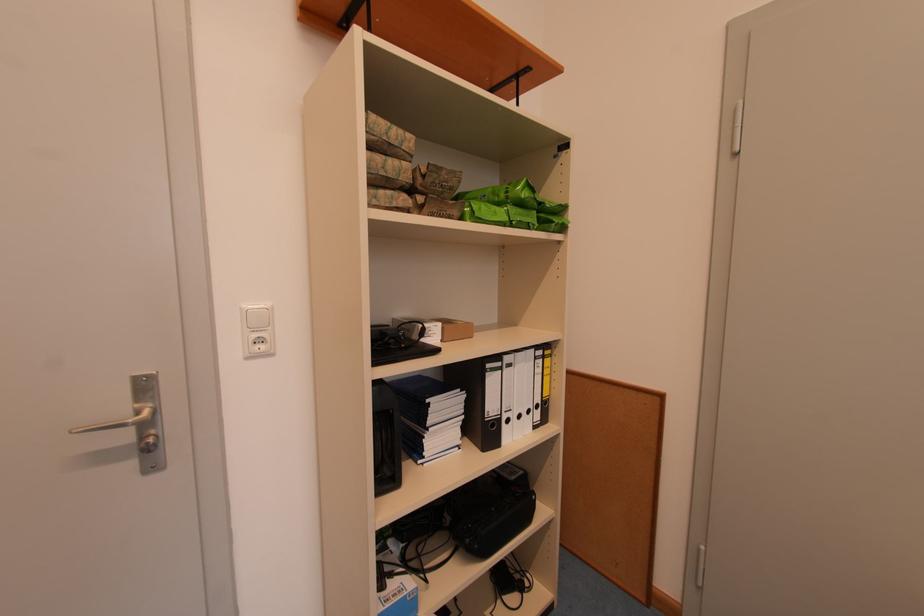
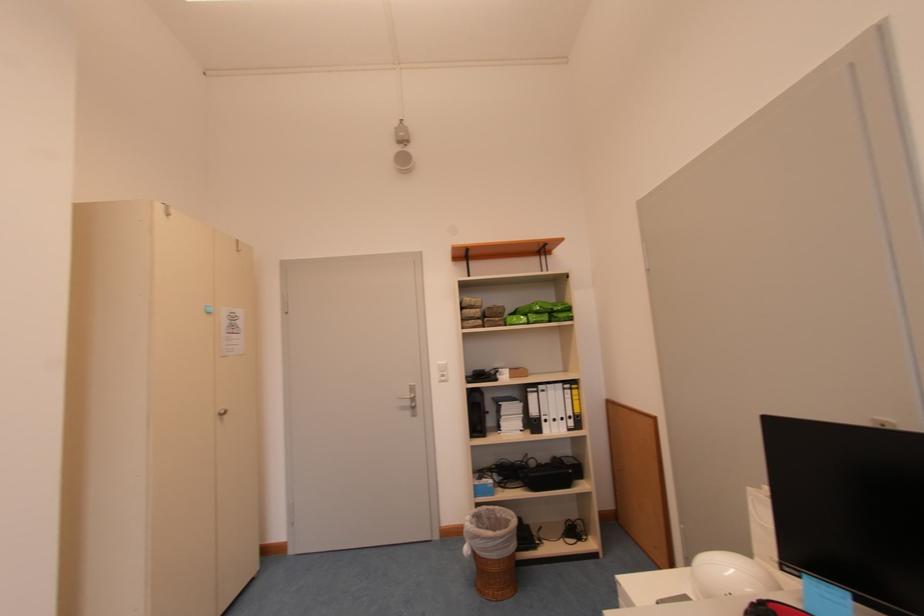
The point at (499, 411) is marked in the first image. Where is the corresponding point in the second image?

(541, 415)